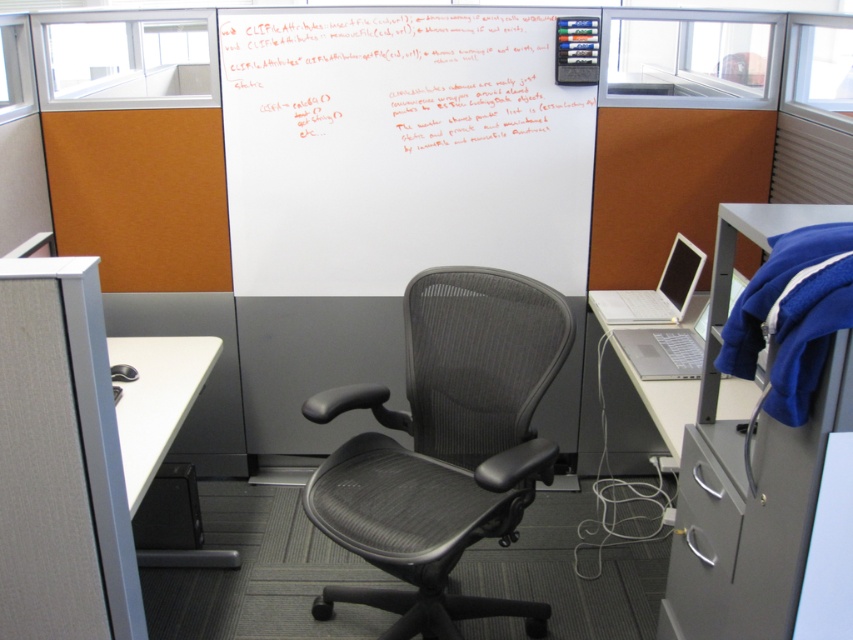
You are a delivery robot trying to navigate to a specific location in the office cubicle. You need to move from your current position to the point labeled point (132, 400). However, there is an obstacle at point (686, 461). Since both points are in your path, which point should you avoid first to reach your destination safely?

You should avoid the point (686, 461) first because it is closer to the camera and therefore closer to your current position, making it the first obstacle in your path to the destination point (132, 400).

You are an office worker who needs to present a diagram. You have a whiteboard at upper center and a silver metallic laptop at right. Which tool can you use to draw the diagram?

The whiteboard at upper center is bigger than the silver metallic laptop at right, so you can use the whiteboard at upper center to draw the diagram.

You are organizing your office space and need to move the gray metallic file cabinet at right to the left side of the white matte table at lower left. Based on their current positions, will the file cabinet block access to the table when moved?

The gray metallic file cabinet at right is currently in front of the white matte table at lower left, so moving it to the left side of the table might block access to the table depending on its size and the available space. However, since the description only states their relative positions and not dimensions, we cannot definitively determine if it would block access without more information.